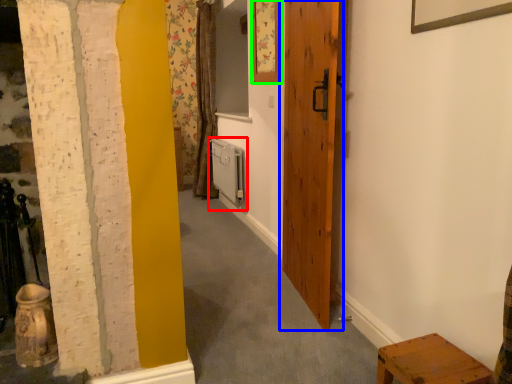
Question: Based on their relative distances, which object is nearer to radiator (highlighted by a red box)? Choose from door (highlighted by a blue box) and picture frame (highlighted by a green box).

Choices:
 (A) door
 (B) picture frame

Answer: (B)